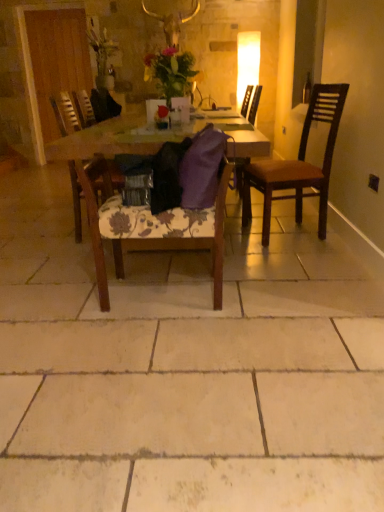
Question: Should I look upward or downward to see wooden chair at center, which ranks as the second chair in left-to-right order?

Choices:
 (A) down
 (B) up

Answer: (B)

Question: Is wooden chair at center, placed as the 2th chair when sorted from right to left, smaller than wooden chair at center, acting as the third chair starting from the right?

Choices:
 (A) yes
 (B) no

Answer: (A)

Question: Does wooden chair at center, which ranks as the second chair in left-to-right order, have a greater height compared to wooden chair at center, the first chair positioned from the left?

Choices:
 (A) yes
 (B) no

Answer: (B)

Question: Does wooden chair at center, placed as the 2th chair when sorted from right to left, contain wooden chair at center, acting as the third chair starting from the right?

Choices:
 (A) yes
 (B) no

Answer: (B)

Question: Is wooden chair at center, placed as the 2th chair when sorted from right to left, directly adjacent to wooden chair at center, the first chair positioned from the left?

Choices:
 (A) yes
 (B) no

Answer: (B)

Question: From a real-world perspective, does wooden chair at center, placed as the 2th chair when sorted from right to left, sit lower than wooden chair at center, the first chair positioned from the left?

Choices:
 (A) yes
 (B) no

Answer: (A)

Question: Is wooden chair at center, placed as the 2th chair when sorted from right to left, located outside wooden chair at center, the first chair positioned from the left?

Choices:
 (A) no
 (B) yes

Answer: (B)

Question: Considering the relative sizes of wooden chair at center, acting as the third chair starting from the right, and transparent glass bottle at upper right in the image provided, is wooden chair at center, acting as the third chair starting from the right, thinner than transparent glass bottle at upper right?

Choices:
 (A) yes
 (B) no

Answer: (B)

Question: From a real-world perspective, is wooden chair at center, acting as the third chair starting from the right, on top of transparent glass bottle at upper right?

Choices:
 (A) yes
 (B) no

Answer: (B)

Question: Could transparent glass bottle at upper right be considered to be inside wooden chair at center, the first chair positioned from the left?

Choices:
 (A) yes
 (B) no

Answer: (B)

Question: Does wooden chair at center, acting as the third chair starting from the right, have a lesser height compared to transparent glass bottle at upper right?

Choices:
 (A) yes
 (B) no

Answer: (B)

Question: Can you confirm if wooden chair at center, acting as the third chair starting from the right, is taller than transparent glass bottle at upper right?

Choices:
 (A) yes
 (B) no

Answer: (A)

Question: From the image's perspective, is wooden chair at center, the first chair positioned from the left, below transparent glass bottle at upper right?

Choices:
 (A) no
 (B) yes

Answer: (B)

Question: Is wooden chair at center, placed as the 2th chair when sorted from right to left, touching dark brown wood chair at right, the 3th chair positioned from the left?

Choices:
 (A) yes
 (B) no

Answer: (B)